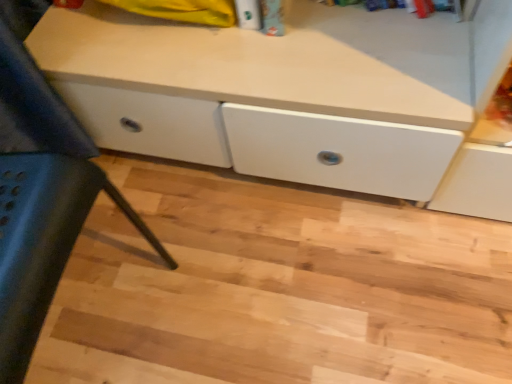
Question: From their relative heights in the image, would you say natural wood stair at center is taller or shorter than matte white cabinet at lower left?

Choices:
 (A) short
 (B) tall

Answer: (A)

Question: Is natural wood stair at center bigger or smaller than matte white cabinet at lower left?

Choices:
 (A) big
 (B) small

Answer: (B)

Question: Is natural wood stair at center inside or outside of matte white cabinet at lower left?

Choices:
 (A) outside
 (B) inside

Answer: (A)

Question: Would you say matte white cabinet at lower left is to the left or to the right of natural wood stair at center in the picture?

Choices:
 (A) right
 (B) left

Answer: (B)

Question: Is point (28, 244) positioned closer to the camera than point (344, 375)?

Choices:
 (A) closer
 (B) farther

Answer: (A)

Question: In terms of size, does matte white cabinet at lower left appear bigger or smaller than natural wood stair at center?

Choices:
 (A) big
 (B) small

Answer: (A)

Question: Is matte white cabinet at lower left situated inside natural wood stair at center or outside?

Choices:
 (A) outside
 (B) inside

Answer: (A)